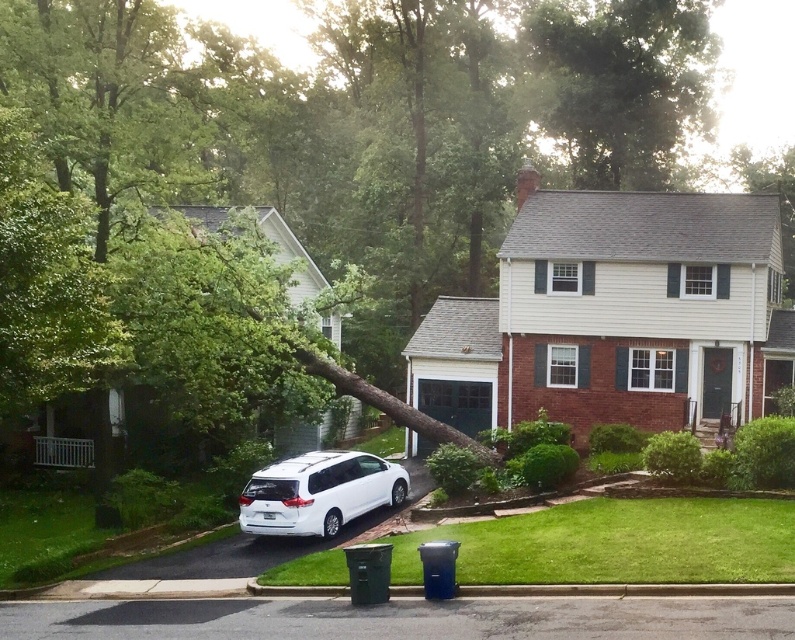
You are a delivery driver trying to reach the garage of the house in the foreground. You see the green leafy tree at upper center and the white matte van at lower left. Which object might be blocking your path to the garage?

The green leafy tree at upper center is larger than the white matte van at lower left, so it is more likely blocking the path to the garage.

From the picture: You are a delivery driver who needs to park your white matte van at lower left near the green leafy tree at upper center. Can you park the van under the tree without hitting the branches?

The green leafy tree at upper center is taller than the white matte van at lower left, so there should be enough vertical space to park the van under the tree without hitting the branches.